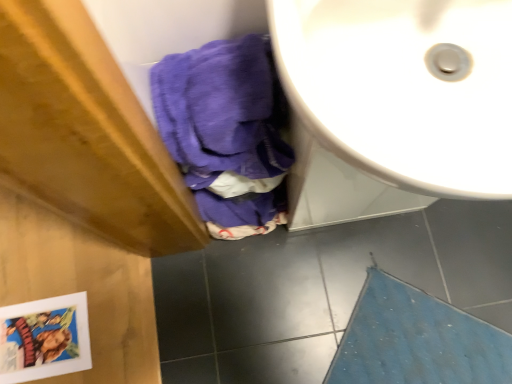
Question: From the image's perspective, is blue textured bath mat at lower right below white glossy sink at upper right?

Choices:
 (A) yes
 (B) no

Answer: (A)

Question: Considering the relative sizes of blue textured bath mat at lower right and white glossy sink at upper right in the image provided, is blue textured bath mat at lower right thinner than white glossy sink at upper right?

Choices:
 (A) no
 (B) yes

Answer: (A)

Question: Considering the relative sizes of blue textured bath mat at lower right and white glossy sink at upper right in the image provided, is blue textured bath mat at lower right smaller than white glossy sink at upper right?

Choices:
 (A) no
 (B) yes

Answer: (B)

Question: Considering the relative sizes of blue textured bath mat at lower right and white glossy sink at upper right in the image provided, is blue textured bath mat at lower right shorter than white glossy sink at upper right?

Choices:
 (A) yes
 (B) no

Answer: (A)

Question: Is blue textured bath mat at lower right looking in the opposite direction of white glossy sink at upper right?

Choices:
 (A) no
 (B) yes

Answer: (A)

Question: Is blue textured bath mat at lower right touching white glossy sink at upper right?

Choices:
 (A) no
 (B) yes

Answer: (A)

Question: Can you confirm if white glossy sink at upper right is wider than blue textured bath mat at lower right?

Choices:
 (A) yes
 (B) no

Answer: (B)

Question: From a real-world perspective, is white glossy sink at upper right located beneath blue textured bath mat at lower right?

Choices:
 (A) no
 (B) yes

Answer: (A)

Question: Is white glossy sink at upper right closer to the viewer compared to blue textured bath mat at lower right?

Choices:
 (A) yes
 (B) no

Answer: (A)

Question: From a real-world perspective, is white glossy sink at upper right located higher than blue textured bath mat at lower right?

Choices:
 (A) no
 (B) yes

Answer: (B)

Question: Is the position of white glossy sink at upper right more distant than that of blue textured bath mat at lower right?

Choices:
 (A) yes
 (B) no

Answer: (B)

Question: Is white glossy sink at upper right next to blue textured bath mat at lower right?

Choices:
 (A) yes
 (B) no

Answer: (B)

Question: Does point (384, 296) appear closer or farther from the camera than point (424, 48)?

Choices:
 (A) farther
 (B) closer

Answer: (A)